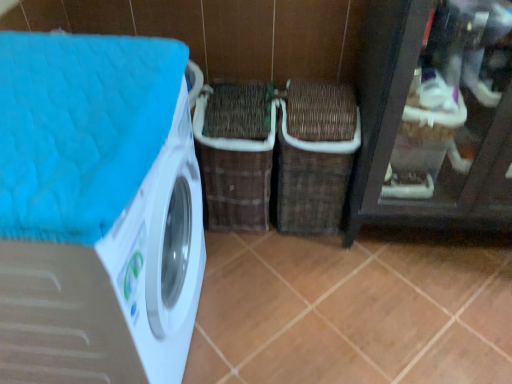
Question: Is brown woven basket at center, placed as the first basket when sorted from left to right, surrounding brown matte tile at center?

Choices:
 (A) yes
 (B) no

Answer: (B)

Question: Is brown woven basket at center, placed as the second basket when sorted from right to left, not near brown matte tile at center?

Choices:
 (A) no
 (B) yes

Answer: (A)

Question: Is the position of brown woven basket at center, placed as the first basket when sorted from left to right, more distant than that of brown matte tile at center?

Choices:
 (A) yes
 (B) no

Answer: (A)

Question: Is brown woven basket at center, placed as the second basket when sorted from right to left, directly adjacent to brown matte tile at center?

Choices:
 (A) no
 (B) yes

Answer: (A)

Question: Can you confirm if brown woven basket at center, placed as the first basket when sorted from left to right, is positioned to the left of brown matte tile at center?

Choices:
 (A) no
 (B) yes

Answer: (B)

Question: Looking at their shapes, would you say woven brown basket at center, which is counted as the 2th basket, starting from the left, is wider or thinner than brown matte tile at center?

Choices:
 (A) thin
 (B) wide

Answer: (A)

Question: In terms of size, does woven brown basket at center, positioned as the 1th basket in right-to-left order, appear bigger or smaller than brown matte tile at center?

Choices:
 (A) big
 (B) small

Answer: (A)

Question: Considering the relative positions of woven brown basket at center, which is counted as the 2th basket, starting from the left, and brown matte tile at center in the image provided, is woven brown basket at center, which is counted as the 2th basket, starting from the left, to the left or to the right of brown matte tile at center?

Choices:
 (A) left
 (B) right

Answer: (A)

Question: In terms of height, does woven brown basket at center, which is counted as the 2th basket, starting from the left, look taller or shorter compared to brown matte tile at center?

Choices:
 (A) tall
 (B) short

Answer: (A)

Question: From a real-world perspective, relative to woven brown basket at center, positioned as the 1th basket in right-to-left order, is brown woven basket at center, placed as the second basket when sorted from right to left, vertically above or below?

Choices:
 (A) above
 (B) below

Answer: (B)

Question: From the image's perspective, is brown woven basket at center, placed as the second basket when sorted from right to left, above or below woven brown basket at center, which is counted as the 2th basket, starting from the left?

Choices:
 (A) below
 (B) above

Answer: (B)

Question: Based on their sizes in the image, would you say brown woven basket at center, placed as the first basket when sorted from left to right, is bigger or smaller than woven brown basket at center, positioned as the 1th basket in right-to-left order?

Choices:
 (A) small
 (B) big

Answer: (B)

Question: Is brown woven basket at center, placed as the first basket when sorted from left to right, to the left or to the right of woven brown basket at center, positioned as the 1th basket in right-to-left order, in the image?

Choices:
 (A) right
 (B) left

Answer: (B)

Question: Choose the correct answer: Is woven brown basket at center, which is counted as the 2th basket, starting from the left, inside brown woven basket at center, placed as the first basket when sorted from left to right, or outside it?

Choices:
 (A) outside
 (B) inside

Answer: (A)

Question: From the image's perspective, is woven brown basket at center, positioned as the 1th basket in right-to-left order, located above or below brown woven basket at center, placed as the first basket when sorted from left to right?

Choices:
 (A) below
 (B) above

Answer: (A)